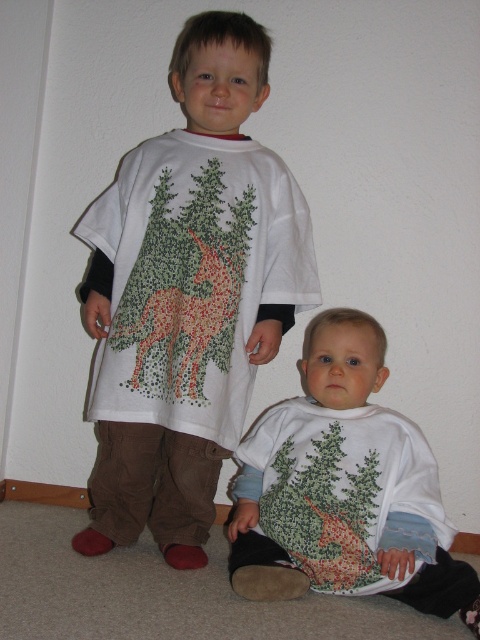
In the scene shown: You are a photographer standing at the camera position. You want to take a photo of the two children in the scene. The camera has a focus range of 4 feet. Can you focus on the point at point (x=207, y=220) without adjusting your position?

The distance between point (x=207, y=220) and the camera is 4.79 feet, which is beyond the camera focus range of 4 feet. Therefore, you cannot focus on the point at point (x=207, y=220) without adjusting your position.